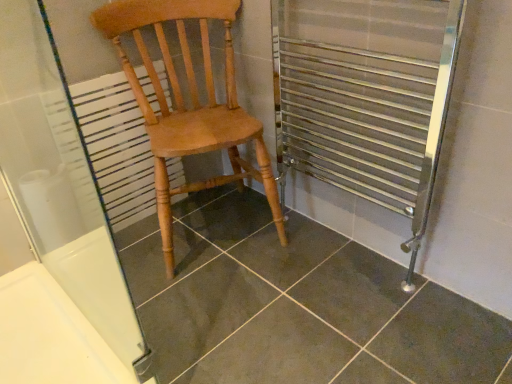
Where is `free location in front of white textured radiator at left`? This screenshot has height=384, width=512. free location in front of white textured radiator at left is located at coordinates (121, 258).